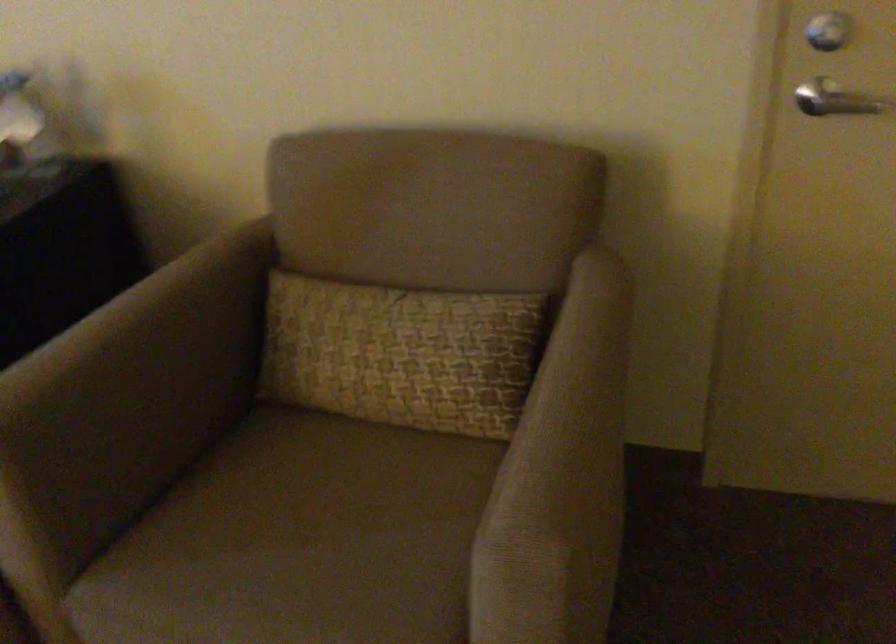
The location [401,353] corresponds to which object?

It corresponds to the patterned pillow in the image.